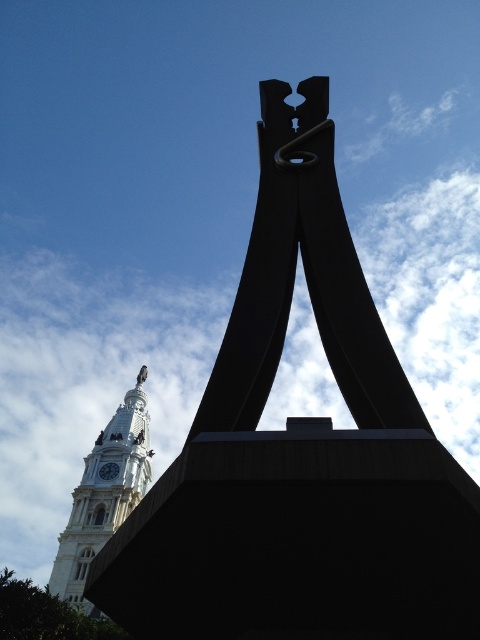
You are an architect analyzing the spatial relationship between the white stone clock tower at lower left and the gold metallic clock at upper left in the image. Which object occupies more horizontal space in the scene?

The white stone clock tower at lower left might be wider than gold metallic clock at upper left, so it likely occupies more horizontal space in the scene.

You are standing in front of a modern sculpture and looking at a point marked at coordinates (300,452). What object is located at that point?

The point at coordinates (300,452) marks the black matte sculpture at center.